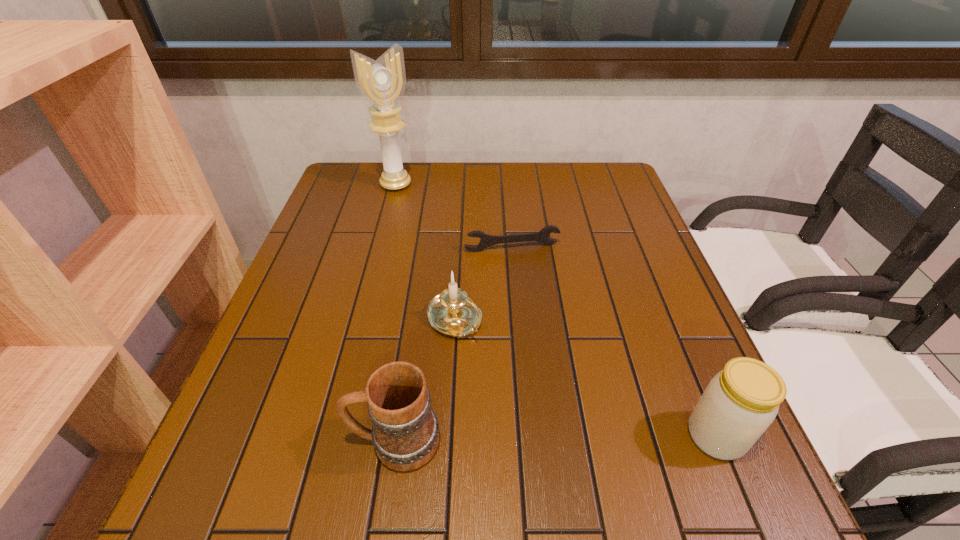
This screenshot has width=960, height=540. I want to click on free space located on the side of the mug with the handle, so click(x=314, y=441).

The height and width of the screenshot is (540, 960). I want to click on blank area located on the left of the rightmost object, so click(x=473, y=436).

The image size is (960, 540). I want to click on vacant region located on the open ends of the shortest object, so click(x=540, y=320).

Identify the location of vacant area situated 0.050m on the open ends of the shortest object. The height and width of the screenshot is (540, 960). coord(523,266).

The height and width of the screenshot is (540, 960). What are the coordinates of `free space located 0.320m on the open ends of the shortest object` in the screenshot? It's located at (550, 354).

Identify the location of free space located 0.120m on the front-facing side of the award. (419, 213).

The width and height of the screenshot is (960, 540). I want to click on free region located 0.200m on the front-facing side of the award, so click(429, 228).

I want to click on vacant space located on the front-facing side of the award, so click(458, 267).

Where is `vacant space situated on the handle side of the third nearest object`? vacant space situated on the handle side of the third nearest object is located at coordinates (482, 357).

At what (x,y) coordinates should I click in order to perform the action: click on free space located 0.260m on the handle side of the third nearest object. Please return your answer as a coordinate pair (x, y). The height and width of the screenshot is (540, 960). Looking at the image, I should click on (549, 441).